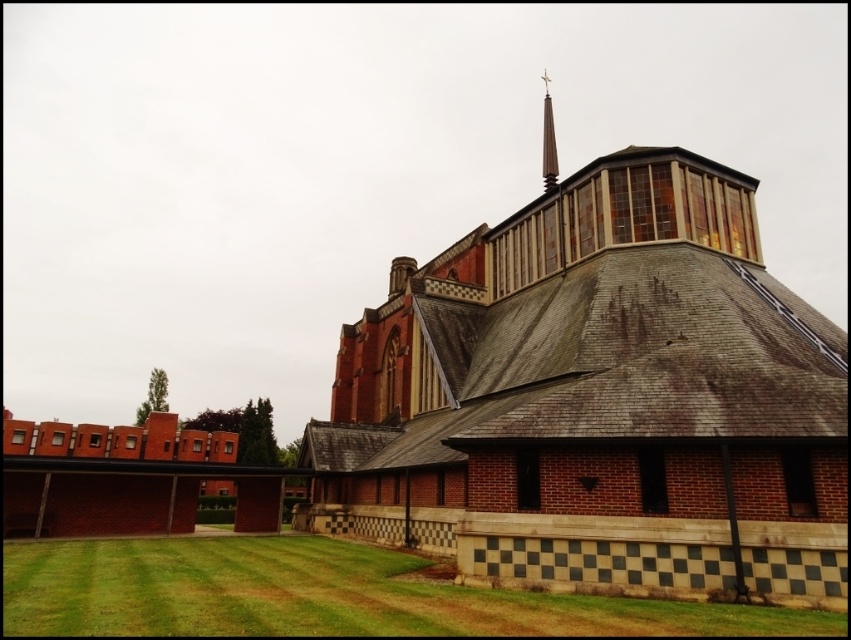
Based on the photo, you are standing in front of the church and want to walk towards the green grass at lower left and the smooth gray spire at upper center. Which one will you reach first?

You will reach the green grass at lower left first because it is closer to you than the smooth gray spire at upper center.

You are standing in a park across from the brick church at center. You want to take a photo of the church from where you are standing. Do you think the church will appear large enough in your photo? Explain your reasoning based on the distance provided.

The brick church at center is 21.43 meters away from the viewer. Since the church is a large building, even at this distance, it should appear sufficiently large in the photo to be recognizable and prominent in the frame.